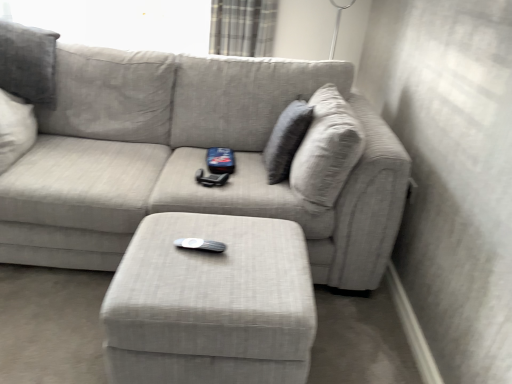
Question: From the image's perspective, is matte gray ottoman at center located above or below textured gray pillow at upper right?

Choices:
 (A) above
 (B) below

Answer: (B)

Question: From a real-world perspective, is matte gray ottoman at center physically located above or below textured gray pillow at upper right?

Choices:
 (A) below
 (B) above

Answer: (A)

Question: Based on their relative distances, which object is nearer to the textured gray couch at center?

Choices:
 (A) textured gray pillow at upper right
 (B) plaid fabric curtain at upper center
 (C) matte gray ottoman at center

Answer: (A)

Question: Estimate the real-world distances between objects in this image. Which object is farther from the matte gray ottoman at center?

Choices:
 (A) textured gray pillow at upper right
 (B) plaid fabric curtain at upper center
 (C) textured gray couch at center

Answer: (B)